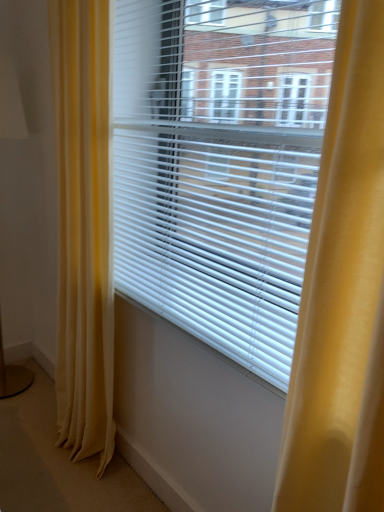
Question: Can you confirm if white plastic blinds at center is thinner than silky yellow curtain at left?

Choices:
 (A) yes
 (B) no

Answer: (A)

Question: Is white plastic blinds at center taller than silky yellow curtain at left?

Choices:
 (A) no
 (B) yes

Answer: (A)

Question: From a real-world perspective, does white plastic blinds at center stand above silky yellow curtain at left?

Choices:
 (A) yes
 (B) no

Answer: (A)

Question: Is white plastic blinds at center located outside silky yellow curtain at left?

Choices:
 (A) yes
 (B) no

Answer: (A)

Question: Can you confirm if white plastic blinds at center is bigger than silky yellow curtain at left?

Choices:
 (A) yes
 (B) no

Answer: (B)

Question: From a real-world perspective, is white plastic blinds at center above or below silky yellow curtain at left?

Choices:
 (A) above
 (B) below

Answer: (A)

Question: From the image's perspective, is white plastic blinds at center positioned above or below silky yellow curtain at left?

Choices:
 (A) above
 (B) below

Answer: (A)

Question: Do you think white plastic blinds at center is within silky yellow curtain at left, or outside of it?

Choices:
 (A) inside
 (B) outside

Answer: (B)

Question: Is white plastic blinds at center wider or thinner than silky yellow curtain at left?

Choices:
 (A) wide
 (B) thin

Answer: (B)

Question: Relative to matte gold table lamp at left, is silky yellow curtain at left in front or behind?

Choices:
 (A) behind
 (B) front

Answer: (B)

Question: Looking at their shapes, would you say silky yellow curtain at left is wider or thinner than matte gold table lamp at left?

Choices:
 (A) wide
 (B) thin

Answer: (B)

Question: Considering the positions of point (86, 91) and point (0, 136), is point (86, 91) closer or farther from the camera than point (0, 136)?

Choices:
 (A) closer
 (B) farther

Answer: (A)

Question: In terms of height, does silky yellow curtain at left look taller or shorter compared to matte gold table lamp at left?

Choices:
 (A) short
 (B) tall

Answer: (B)

Question: From the image's perspective, is white plastic blinds at center positioned above or below matte gold table lamp at left?

Choices:
 (A) above
 (B) below

Answer: (A)

Question: Considering the positions of point (x=182, y=170) and point (x=18, y=119), is point (x=182, y=170) closer or farther from the camera than point (x=18, y=119)?

Choices:
 (A) closer
 (B) farther

Answer: (A)